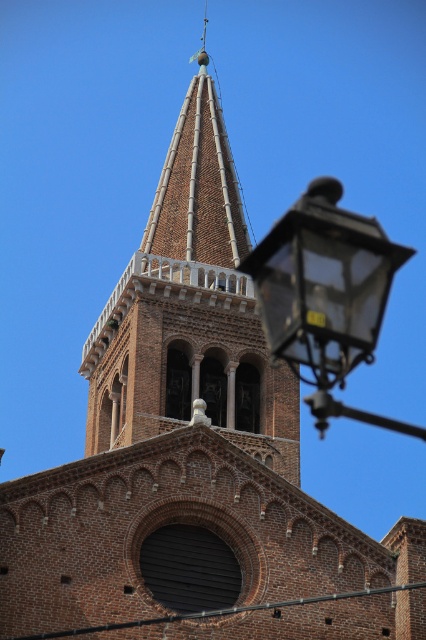
Question: Is brown brick tower at upper center thinner than clear glass lantern at upper right?

Choices:
 (A) no
 (B) yes

Answer: (B)

Question: Observing the image, what is the correct spatial positioning of brown brick tower at upper center in reference to clear glass lantern at upper right?

Choices:
 (A) above
 (B) below

Answer: (A)

Question: Which of the following is the closest to the observer?

Choices:
 (A) (207, 179)
 (B) (374, 321)

Answer: (B)

Question: Is brown brick tower at upper center thinner than clear glass lantern at upper right?

Choices:
 (A) yes
 (B) no

Answer: (A)

Question: Which object is farther from the camera taking this photo?

Choices:
 (A) clear glass lantern at upper right
 (B) brown brick tower at upper center

Answer: (B)